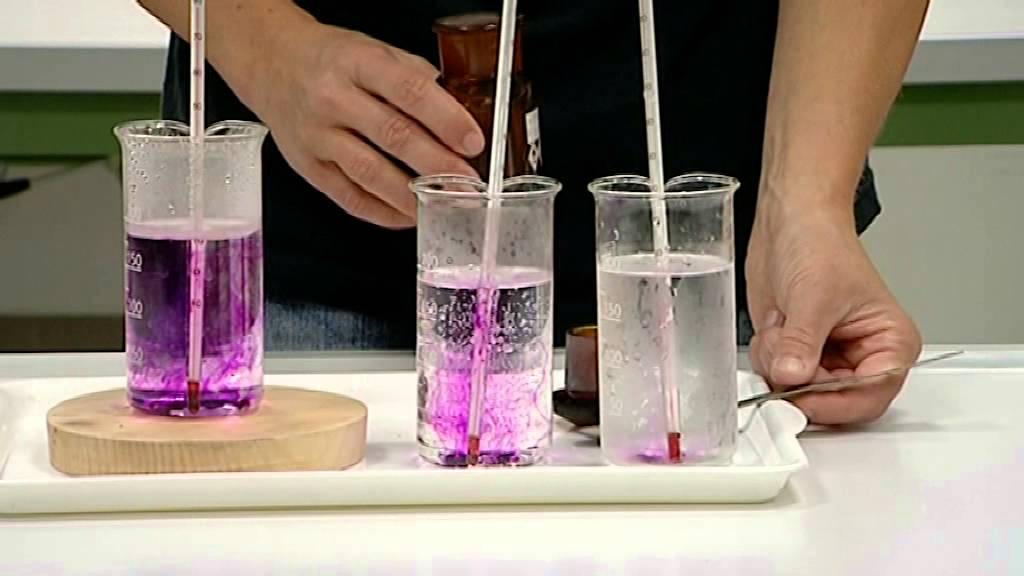
This screenshot has height=576, width=1024. I want to click on thermometers, so click(194, 109), click(500, 117), click(654, 155).